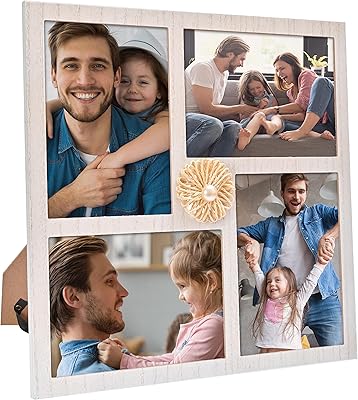
Image resolution: width=358 pixels, height=400 pixels. Identify the location of furnishings. (264, 140), (137, 340), (175, 322), (311, 343).